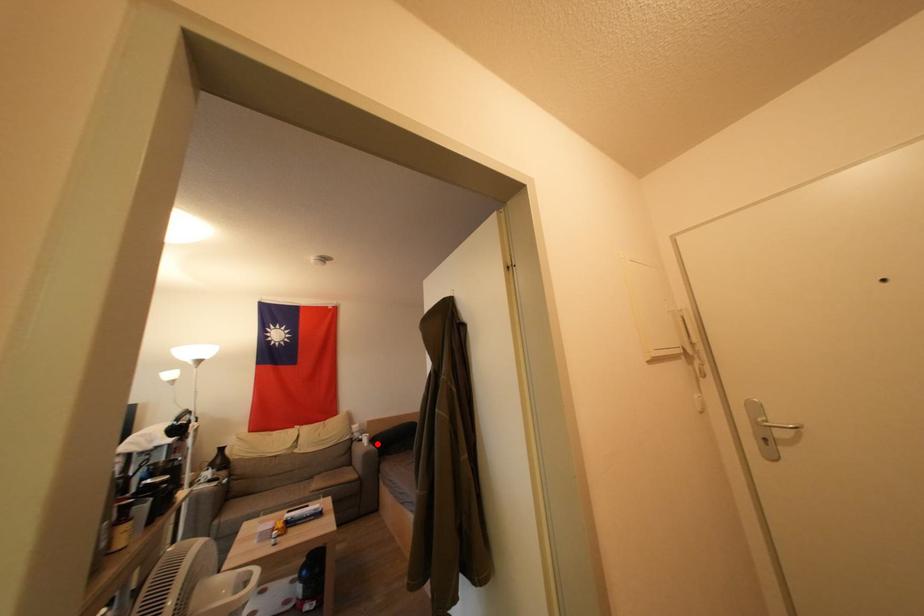
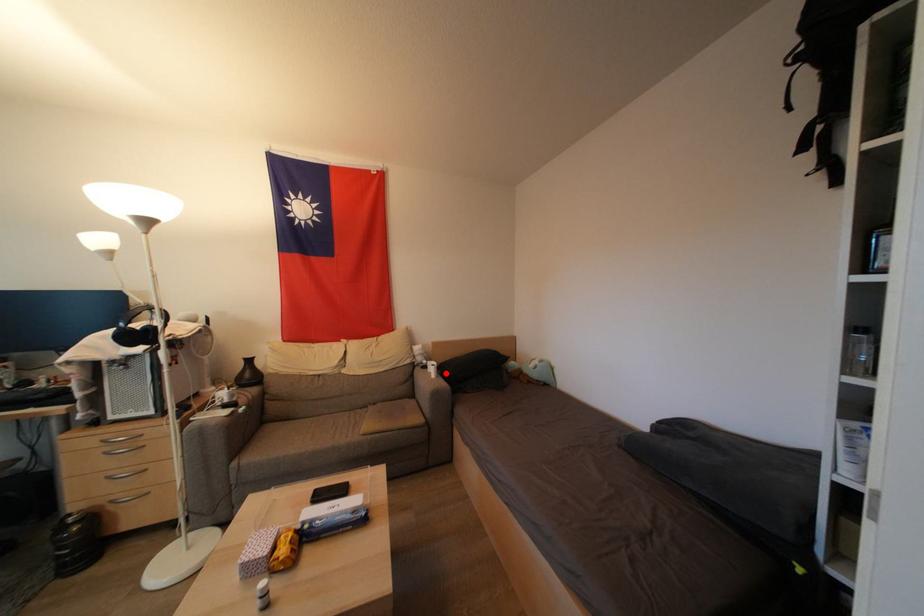
I am providing you with two images of the same scene from different viewpoints. A red point is marked on the first image and another point is marked on the second image. Do the highlighted points in image1 and image2 indicate the same real-world spot?

Yes